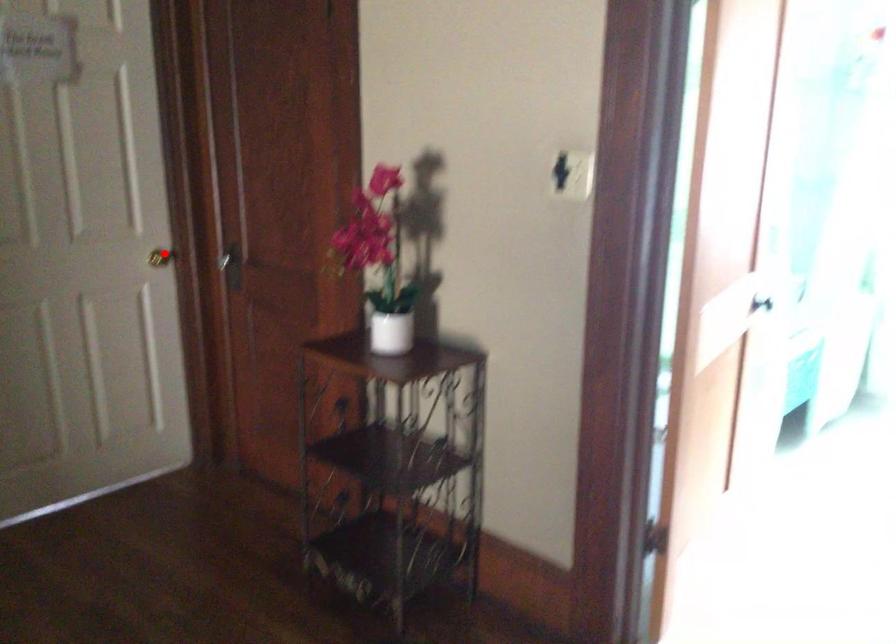
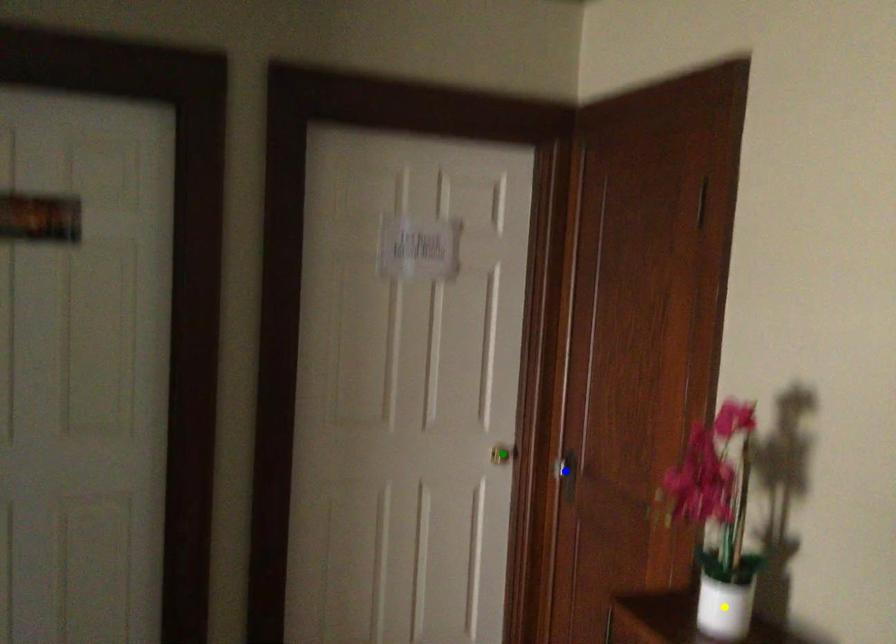
Question: I am providing you with two images of the same scene from different viewpoints. A red point is marked on the first image. You are given multiple points on the second image. Which point in image 2 represents the same 3d spot as the red point in image 1?

Choices:
 (A) yellow point
 (B) blue point
 (C) green point

Answer: (C)